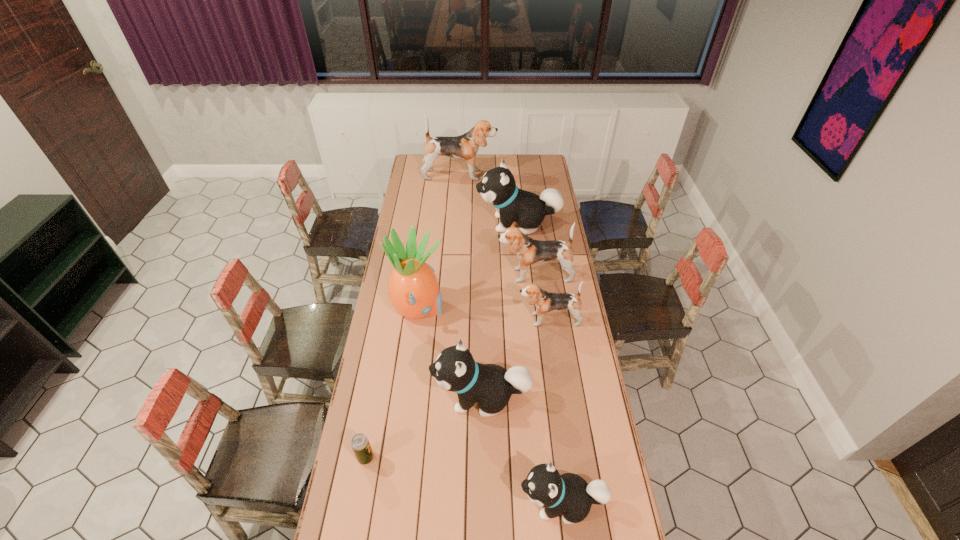
You are a GUI agent. You are given a task and a screenshot of the screen. Output one action in this format:
    pyautogui.click(x=<x>, y=<y>)
    Task: Click on the free space located at the face of the sixth nearest object
    The width and height of the screenshot is (960, 540).
    Given the screenshot: What is the action you would take?
    pyautogui.click(x=431, y=275)

Identify the location of vacant space located 0.050m at the face of the sixth nearest object. This screenshot has height=540, width=960. (486, 275).

I want to click on blank space located at the face of the sixth nearest object, so click(422, 275).

The image size is (960, 540). I want to click on free location located at the face of the sixth farthest object, so click(403, 397).

You are a GUI agent. You are given a task and a screenshot of the screen. Output one action in this format:
    pyautogui.click(x=<x>, y=<y>)
    Task: Click on the vacant space located 0.210m at the face of the sixth farthest object
    
    Given the screenshot: What is the action you would take?
    coord(375,397)

I want to click on vacant area situated at the face of the sixth farthest object, so click(420, 397).

The image size is (960, 540). Identify the location of free space located 0.200m at the face of the nearest brown puppy. (470, 320).

Where is `vacant space located 0.230m at the face of the nearest brown puppy`? Image resolution: width=960 pixels, height=540 pixels. vacant space located 0.230m at the face of the nearest brown puppy is located at coordinates (464, 320).

Locate an element on the screen. vacant space situated at the face of the nearest brown puppy is located at coordinates (447, 320).

Locate an element on the screen. This screenshot has width=960, height=540. vacant area situated 0.070m at the face of the nearest white puppy is located at coordinates point(495,503).